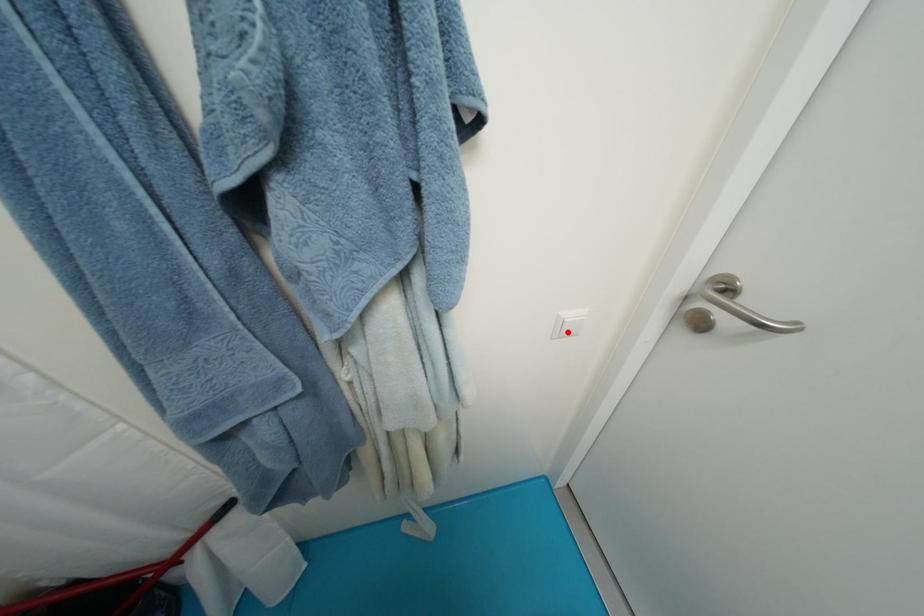
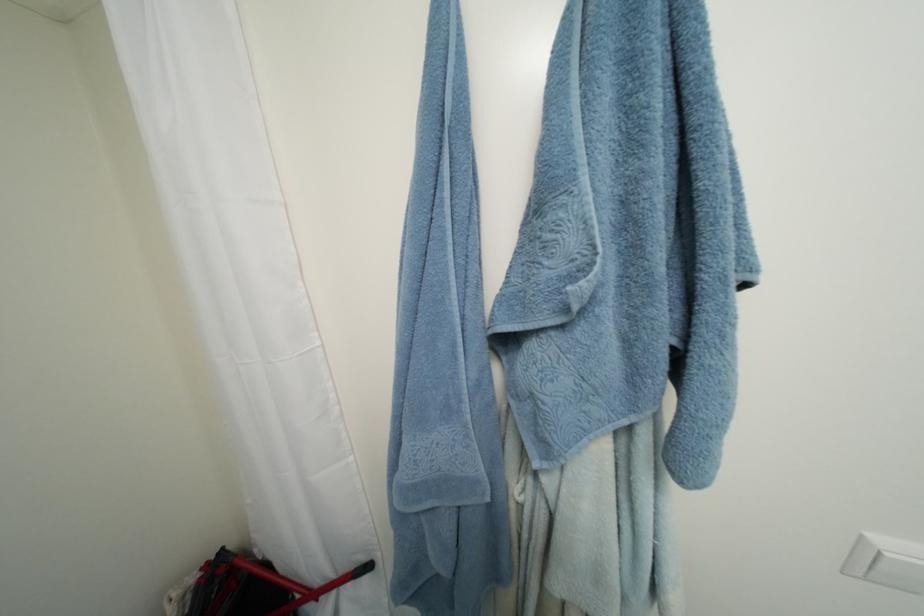
Locate, in the second image, the point that corresponds to the highlighted location in the first image.

(880, 570)